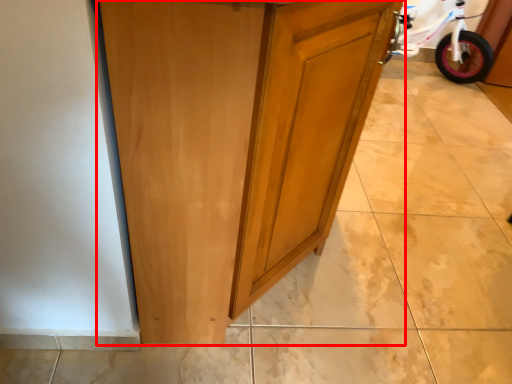
Question: From the image's perspective, considering the relative positions of cupboard (annotated by the red box) and bicycle in the image provided, where is cupboard (annotated by the red box) located with respect to the staircase?

Choices:
 (A) below
 (B) above

Answer: (A)